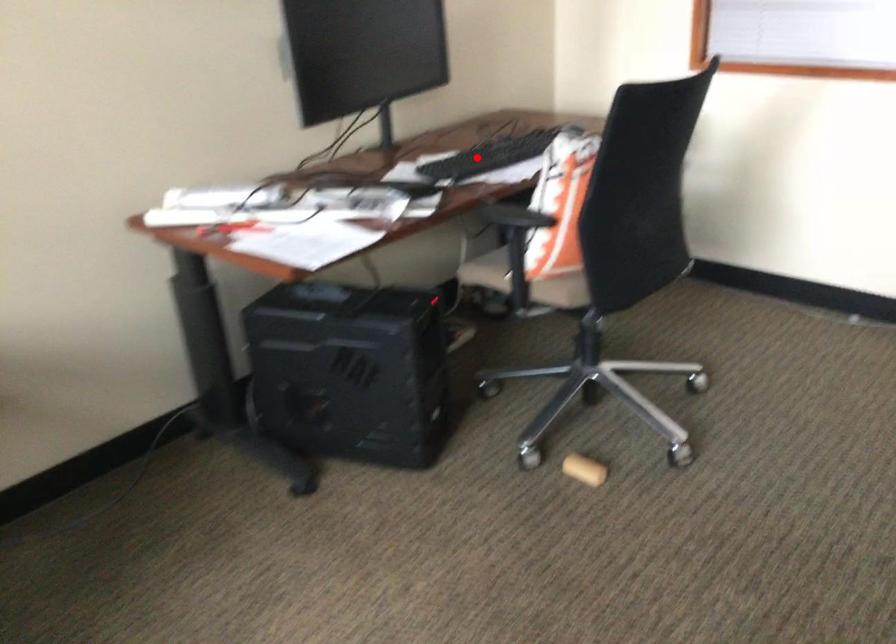
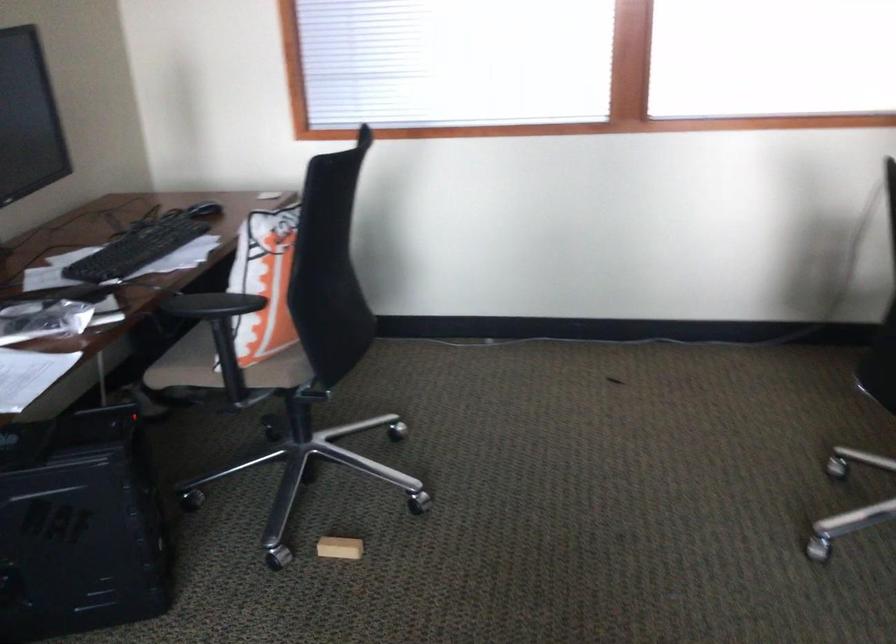
The point at the highlighted location is marked in the first image. Where is the corresponding point in the second image?

(138, 248)